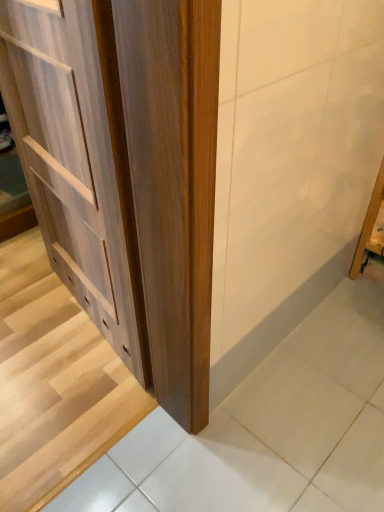
Question: Is wooden door at center smaller than light wood cabinet at left?

Choices:
 (A) yes
 (B) no

Answer: (A)

Question: Is light wood cabinet at left at the back of wooden door at center?

Choices:
 (A) yes
 (B) no

Answer: (B)

Question: Does wooden door at center lie behind light wood cabinet at left?

Choices:
 (A) yes
 (B) no

Answer: (A)

Question: Is wooden door at center directly adjacent to light wood cabinet at left?

Choices:
 (A) yes
 (B) no

Answer: (B)

Question: Does wooden door at center contain light wood cabinet at left?

Choices:
 (A) yes
 (B) no

Answer: (B)

Question: Does wooden door at center have a lesser height compared to light wood cabinet at left?

Choices:
 (A) no
 (B) yes

Answer: (B)

Question: Is light wood cabinet at left to the right of wooden door at center from the viewer's perspective?

Choices:
 (A) no
 (B) yes

Answer: (B)

Question: Are light wood cabinet at left and wooden door at center located far from each other?

Choices:
 (A) yes
 (B) no

Answer: (B)

Question: Considering the relative sizes of light wood cabinet at left and wooden door at center in the image provided, is light wood cabinet at left taller than wooden door at center?

Choices:
 (A) no
 (B) yes

Answer: (B)

Question: Is light wood cabinet at left oriented towards wooden door at center?

Choices:
 (A) yes
 (B) no

Answer: (A)

Question: Is light wood cabinet at left to the left of wooden door at center from the viewer's perspective?

Choices:
 (A) no
 (B) yes

Answer: (A)

Question: From the image's perspective, is light wood cabinet at left under wooden door at center?

Choices:
 (A) yes
 (B) no

Answer: (B)

Question: From the image's perspective, is light wood cabinet at left above or below wooden door at center?

Choices:
 (A) below
 (B) above

Answer: (B)